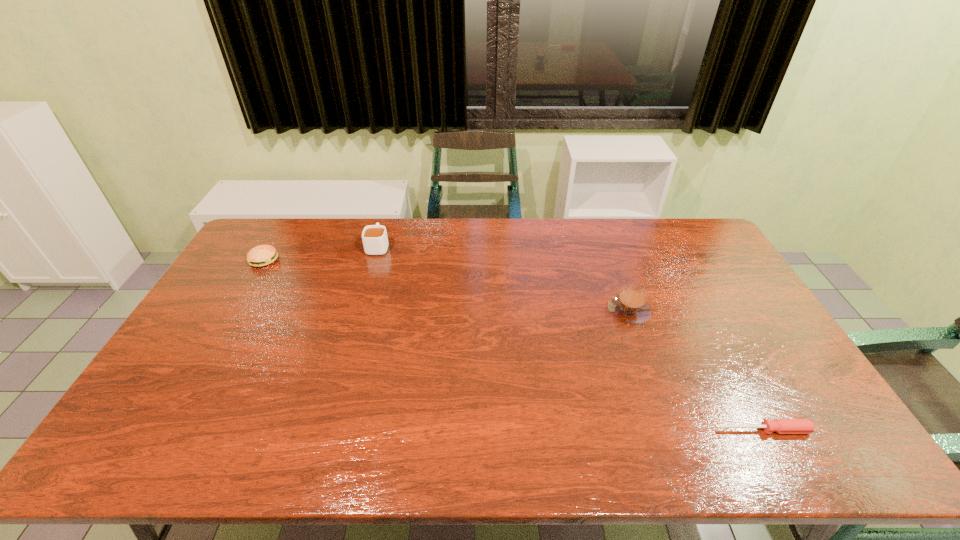
At what (x,y) coordinates should I click in order to perform the action: click on free location at the far edge of the desktop. Please return your answer as a coordinate pair (x, y). The height and width of the screenshot is (540, 960). Looking at the image, I should click on (535, 253).

The width and height of the screenshot is (960, 540). In order to click on free space at the near edge in this screenshot , I will do `click(776, 445)`.

Where is `vacant point at the left edge`? vacant point at the left edge is located at coordinates (200, 360).

This screenshot has width=960, height=540. In the image, there is a desktop. Identify the location of vacant space at the right edge. (809, 417).

The image size is (960, 540). In order to click on blank space at the near left corner of the desktop in this screenshot , I will do `click(119, 454)`.

Image resolution: width=960 pixels, height=540 pixels. I want to click on vacant space at the far right corner, so click(x=675, y=233).

Locate an element on the screen. The width and height of the screenshot is (960, 540). free space between the patty and the nearest object is located at coordinates tap(515, 345).

Locate an element on the screen. This screenshot has height=540, width=960. free point between the third object from right to left and the screwdriver is located at coordinates (571, 338).

Where is `free space between the nearest object and the third farthest object`? free space between the nearest object and the third farthest object is located at coordinates (696, 370).

I want to click on vacant space in between the second object from left to right and the second nearest object, so click(x=503, y=279).